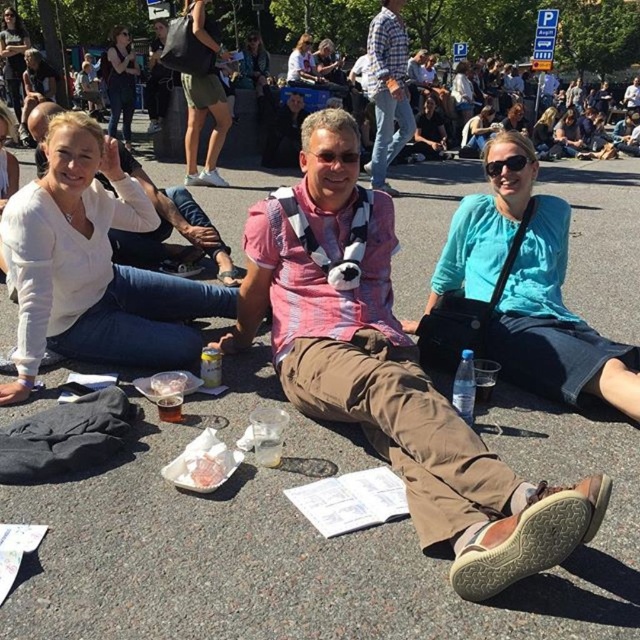
Is white matte shirt at left positioned in front of matte black camera at upper left?

That is True.

Is white matte shirt at left to the right of matte black camera at upper left from the viewer's perspective?

Yes, white matte shirt at left is to the right of matte black camera at upper left.

This screenshot has width=640, height=640. What do you see at coordinates (92, 266) in the screenshot?
I see `white matte shirt at left` at bounding box center [92, 266].

Identify the location of white matte shirt at left. The width and height of the screenshot is (640, 640). (92, 266).

Does white matte shirt at left appear over green cotton shorts at upper center?

No.

Who is higher up, white matte shirt at left or green cotton shorts at upper center?

green cotton shorts at upper center is above.

Which is behind, point (134, 360) or point (193, 28)?

Positioned behind is point (193, 28).

The image size is (640, 640). What are the coordinates of `white matte shirt at left` in the screenshot? It's located at (92, 266).

Between white matte shirt at left and black plastic sunglasses at center, which one appears on the right side from the viewer's perspective?

From the viewer's perspective, black plastic sunglasses at center appears more on the right side.

Does white matte shirt at left have a greater width compared to black plastic sunglasses at center?

Indeed, white matte shirt at left has a greater width compared to black plastic sunglasses at center.

Is point (176, 285) less distant than point (518, 164)?

No, it is not.

Identify the location of white matte shirt at left. (92, 266).